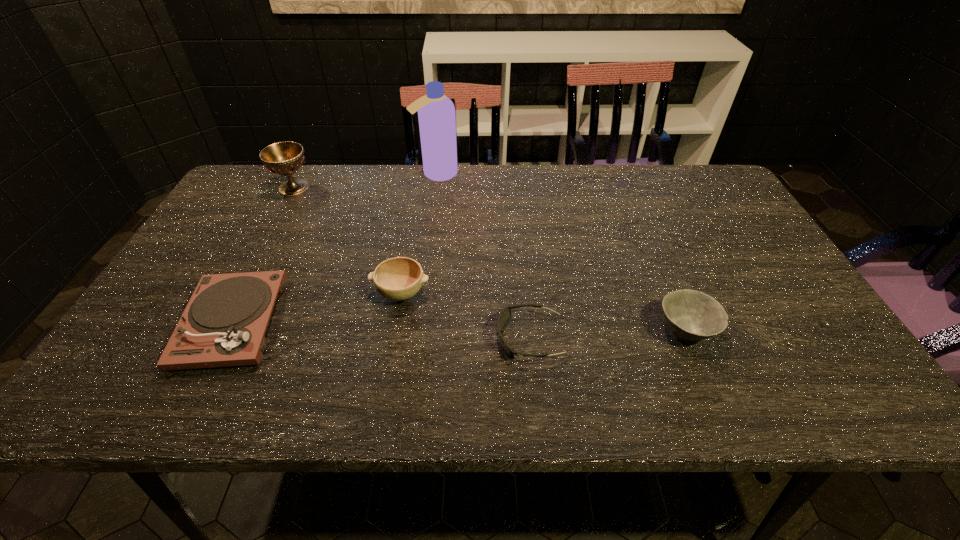
Where is `object that is positioned at the far left corner`? This screenshot has height=540, width=960. object that is positioned at the far left corner is located at coordinates (284, 158).

Find the location of a particular element. The height and width of the screenshot is (540, 960). object positioned at the near left corner is located at coordinates (224, 323).

The width and height of the screenshot is (960, 540). Identify the location of vacant area at the far edge of the desktop. (421, 184).

This screenshot has width=960, height=540. In order to click on free space at the near edge in this screenshot , I will do `click(423, 384)`.

The width and height of the screenshot is (960, 540). In order to click on free space at the left edge of the desktop in this screenshot , I will do `click(241, 235)`.

The width and height of the screenshot is (960, 540). In the image, there is a desktop. What are the coordinates of `free region at the near left corner` in the screenshot? It's located at (168, 381).

Find the location of a particular element. The height and width of the screenshot is (540, 960). vacant space at the far right corner of the desktop is located at coordinates (690, 171).

I want to click on vacant area that lies between the tallest object and the left bowl, so click(419, 233).

Identify the location of vacant space that is in between the rightmost object and the goggles. The height and width of the screenshot is (540, 960). (608, 334).

Identify the location of free space between the rightmost object and the second tallest object. The height and width of the screenshot is (540, 960). (490, 259).